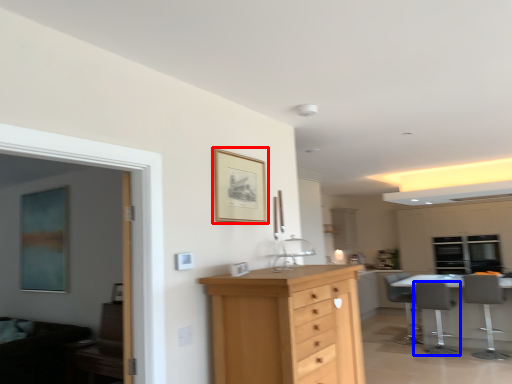
Question: Which of the following is the closest to the observer, picture frame (highlighted by a red box) or chair (highlighted by a blue box)?

Choices:
 (A) picture frame
 (B) chair

Answer: (A)